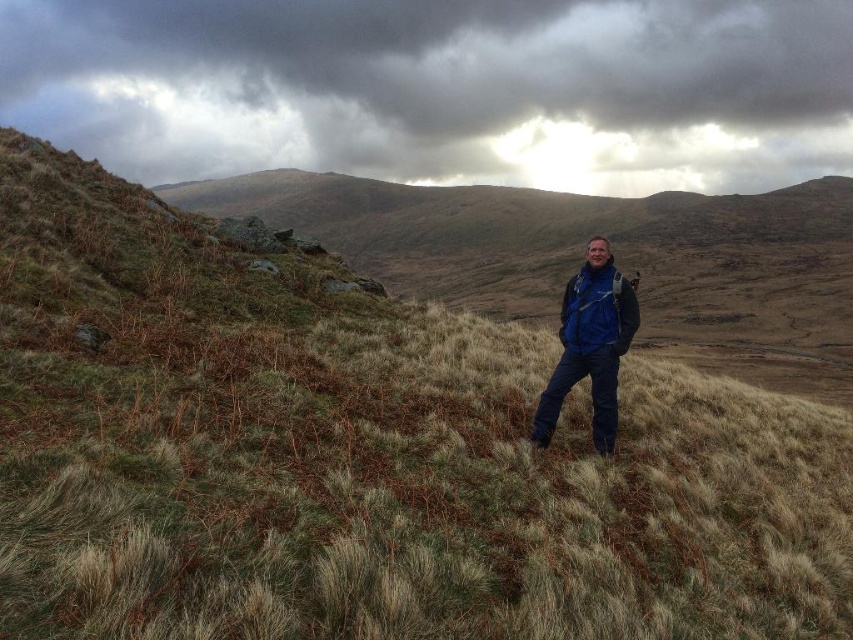
This screenshot has width=853, height=640. Describe the element at coordinates (440, 88) in the screenshot. I see `dark cloudy sky at upper center` at that location.

This screenshot has width=853, height=640. What are the coordinates of `dark cloudy sky at upper center` in the screenshot? It's located at (440, 88).

Is blue fabric jacket at center above blue fleece jacket at center?

No.

Is blue fabric jacket at center behind blue fleece jacket at center?

Yes, blue fabric jacket at center is further from the viewer.

Does point (614, 426) come in front of point (596, 282)?

That is False.

What are the coordinates of `blue fabric jacket at center` in the screenshot? It's located at (590, 344).

Which is more to the left, dark cloudy sky at upper center or blue fabric jacket at center?

From the viewer's perspective, dark cloudy sky at upper center appears more on the left side.

Does dark cloudy sky at upper center have a smaller size compared to blue fabric jacket at center?

No.

Does point (662, 19) come farther from viewer compared to point (543, 408)?

That is True.

Locate an element on the screen. This screenshot has width=853, height=640. dark cloudy sky at upper center is located at coordinates (440, 88).